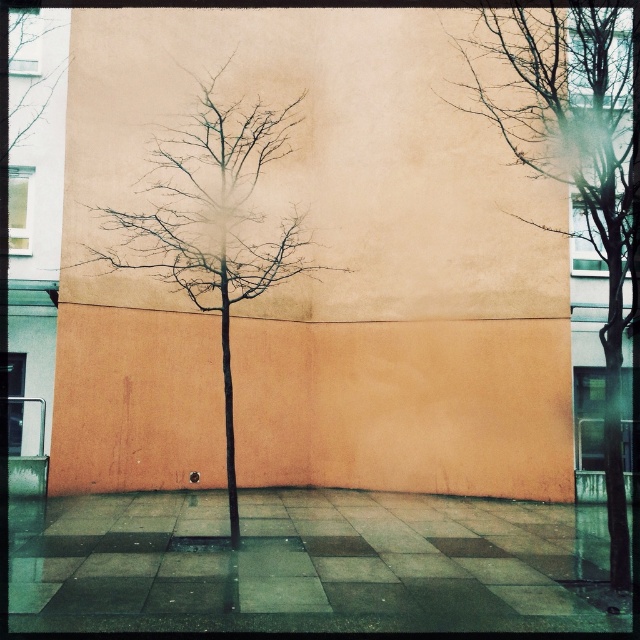
Find the location of a particular element. The height and width of the screenshot is (640, 640). bare branches at center is located at coordinates (577, 164).

Can you confirm if bare branches at center is shorter than brown bark tree at center?

Correct, bare branches at center is not as tall as brown bark tree at center.

Who is more forward, (593, 148) or (188, 272)?

Point (593, 148)

This screenshot has width=640, height=640. In order to click on bare branches at center in this screenshot , I will do `click(577, 164)`.

Who is more forward, (x=563, y=145) or (x=38, y=42)?

Point (x=563, y=145) is more forward.

Between bare branches at center and bare branches at upper left, which one appears on the right side from the viewer's perspective?

bare branches at center is more to the right.

Does point (618, 198) lie in front of point (54, 35)?

Yes, point (618, 198) is in front of point (54, 35).

Where is `bare branches at center`? The height and width of the screenshot is (640, 640). bare branches at center is located at coordinates 577,164.

Can you confirm if brown bark tree at center is positioned to the left of bare branches at upper left?

Incorrect, brown bark tree at center is not on the left side of bare branches at upper left.

Which is in front, point (189, 198) or point (56, 16)?

Positioned in front is point (189, 198).

Identify the location of brown bark tree at center. The width and height of the screenshot is (640, 640). (212, 224).